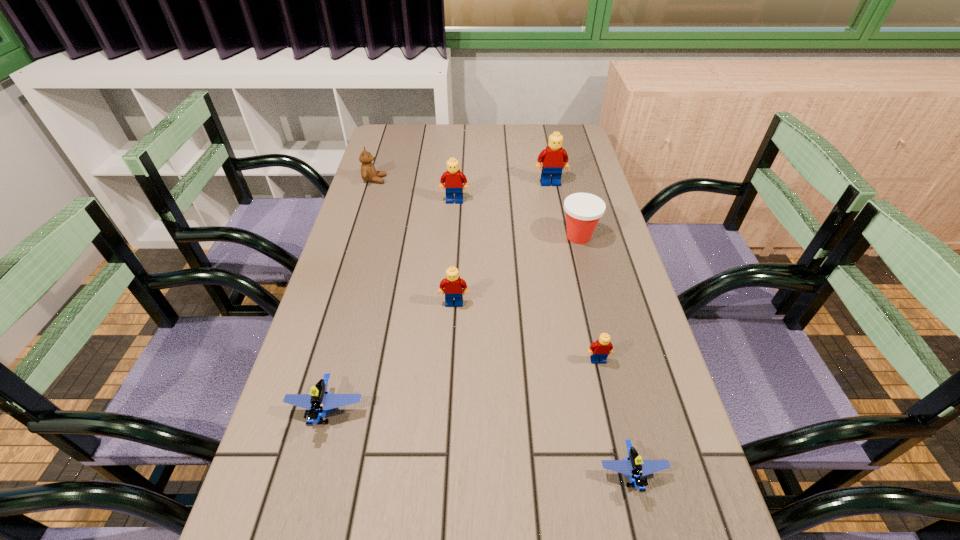
You are a GUI agent. You are given a task and a screenshot of the screen. Output one action in this format:
    pyautogui.click(x=<x>, y=<y>)
    Task: Click on the Lego that is the fifth closest to the sixth nearest object
    
    Given the screenshot: What is the action you would take?
    pyautogui.click(x=633, y=465)

Choose which yellow Lego is the fourth nearest neighbor to the Dixie cup. Please provide its 2D coordinates. Your answer should be formatted as a tuple, i.e. [(x, y)], where the tuple contains the x and y coordinates of a point satisfying the conditions above.

[(599, 350)]

Identify which yellow Lego is the fourth closest to the teddy bear. Please provide its 2D coordinates. Your answer should be formatted as a tuple, i.e. [(x, y)], where the tuple contains the x and y coordinates of a point satisfying the conditions above.

[(599, 350)]

Locate which blue Lego ranks second in proximity to the fifth nearest object. Please provide its 2D coordinates. Your answer should be formatted as a tuple, i.e. [(x, y)], where the tuple contains the x and y coordinates of a point satisfying the conditions above.

[(320, 400)]

Identify which blue Lego is the second nearest to the third smallest yellow Lego. Please provide its 2D coordinates. Your answer should be formatted as a tuple, i.e. [(x, y)], where the tuple contains the x and y coordinates of a point satisfying the conditions above.

[(633, 465)]

The image size is (960, 540). Identify the location of free point that satisfies the following two spatial constraints: 1. on the front-facing side of the Dixie cup; 2. on the right side of the sixth nearest object. (452, 237).

You are a GUI agent. You are given a task and a screenshot of the screen. Output one action in this format:
    pyautogui.click(x=<x>, y=<y>)
    Task: Click on the free location that satisfies the following two spatial constraints: 1. on the front-facing side of the second farthest yellow Lego; 2. on the right side of the Dixie cup
    
    Given the screenshot: What is the action you would take?
    pyautogui.click(x=452, y=237)

The height and width of the screenshot is (540, 960). I want to click on vacant space that satisfies the following two spatial constraints: 1. on the front-facing side of the teddy bear; 2. on the left side of the fourth farthest object, so click(357, 237).

This screenshot has height=540, width=960. I want to click on vacant area in the image that satisfies the following two spatial constraints: 1. on the back side of the fourth farthest object; 2. on the front-facing side of the teddy bear, so click(x=564, y=180).